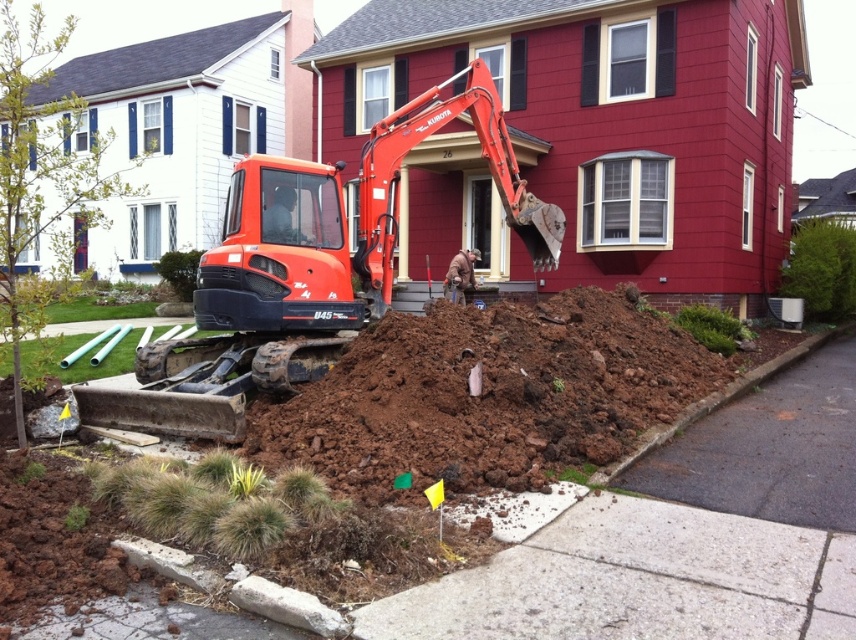
You are a delivery driver and your truck is parked at the dark gray asphalt at lower right. You need to unload a heavy crate onto the brown dirt at center. The truck has a loading ramp that can extend 3 meters. Can you unload the crate without moving the truck?

The brown dirt at center and dark gray asphalt at lower right are 3.64 meters apart from each other. Since the truck can only extend its ramp 3 meters, it is not long enough to reach the brown dirt at center from the dark gray asphalt at lower right. Therefore, you cannot unload the crate without moving the truck.

You are standing at the point labeled point [591,368] and want to walk to the entrance of the house. Which direction should you go relative to point [812,388]?

You should walk towards the entrance of the house, which is behind point [812,388] relative to your current position at point [591,368].